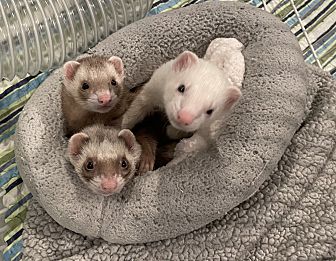
Locate an element on the screen. Image resolution: width=336 pixels, height=261 pixels. carpet is located at coordinates (333, 20).